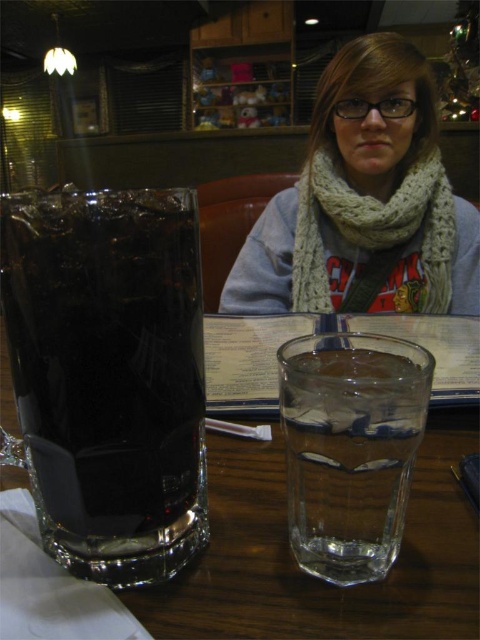
Question: From the image, what is the correct spatial relationship of knitted scarf at upper center in relation to white knitted scarf at upper center?

Choices:
 (A) right
 (B) left

Answer: (A)

Question: Considering the real-world distances, which object is farthest from the dark glass mug at left?

Choices:
 (A) knitted scarf at upper center
 (B) white knitted scarf at upper center
 (C) clear glass water at center

Answer: (A)

Question: Is dark glass mug at left to the right of knitted scarf at upper center from the viewer's perspective?

Choices:
 (A) yes
 (B) no

Answer: (B)

Question: Is dark glass mug at left wider than clear glass water at center?

Choices:
 (A) no
 (B) yes

Answer: (B)

Question: Estimate the real-world distances between objects in this image. Which object is closer to the knitted scarf at upper center?

Choices:
 (A) clear glass water at center
 (B) dark glass mug at left

Answer: (A)

Question: Estimate the real-world distances between objects in this image. Which object is farther from the clear glass water at center?

Choices:
 (A) white knitted scarf at upper center
 (B) dark glass mug at left

Answer: (A)